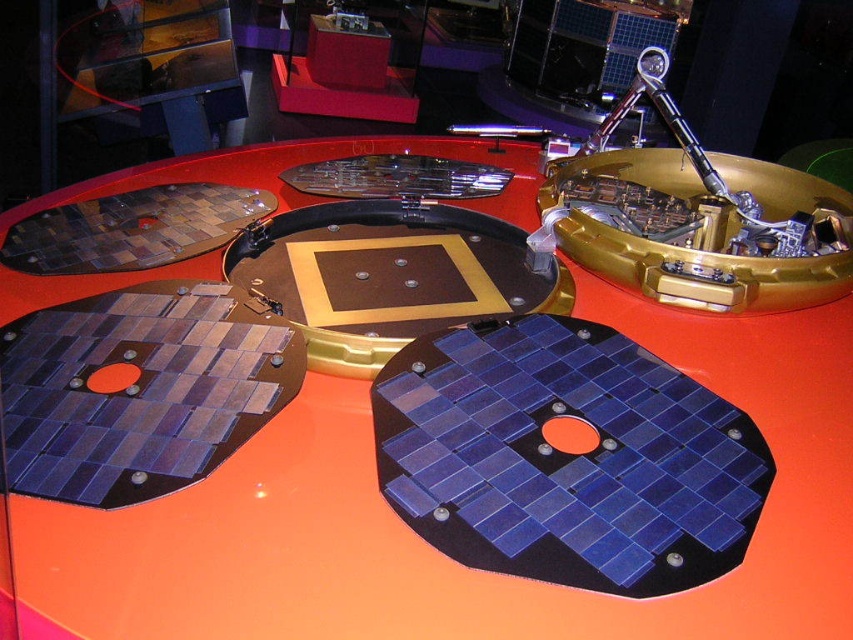
You are an engineer working on a spacecraft model. You need to attach a new component to the gold metallic robotic arm at upper center. The component requires a space wider than the blue glossy solar panel at center. Is the robotic arm wide enough?

The blue glossy solar panel at center has a lesser width compared to the gold metallic robotic arm at upper center, so the robotic arm is wider than the solar panel. Therefore, the gold metallic robotic arm at upper center has enough width to accommodate the new component.